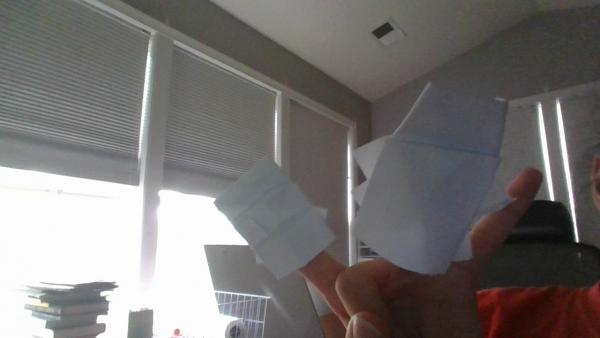
Where is `white papers`? The height and width of the screenshot is (338, 600). white papers is located at coordinates (426, 209), (277, 249), (371, 153), (361, 190), (438, 132).